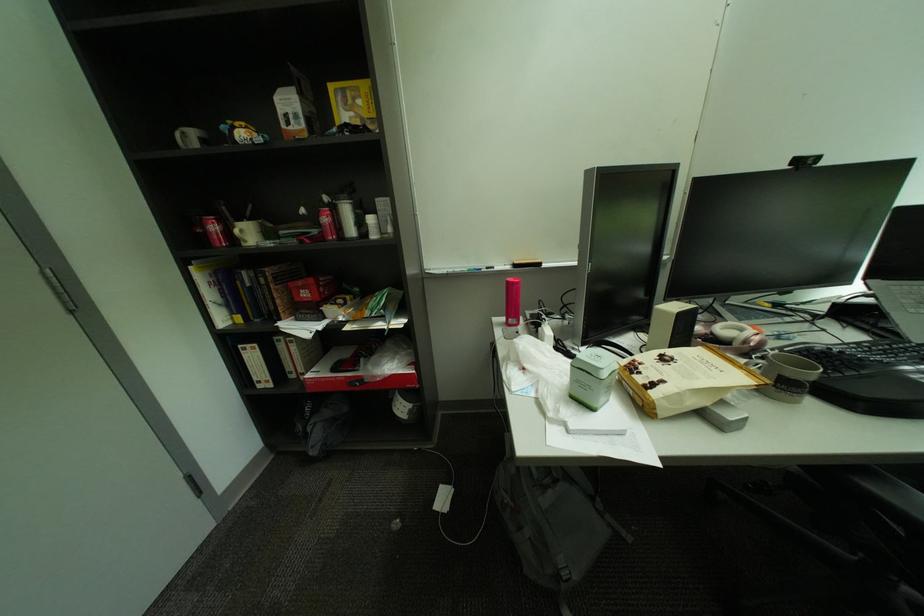
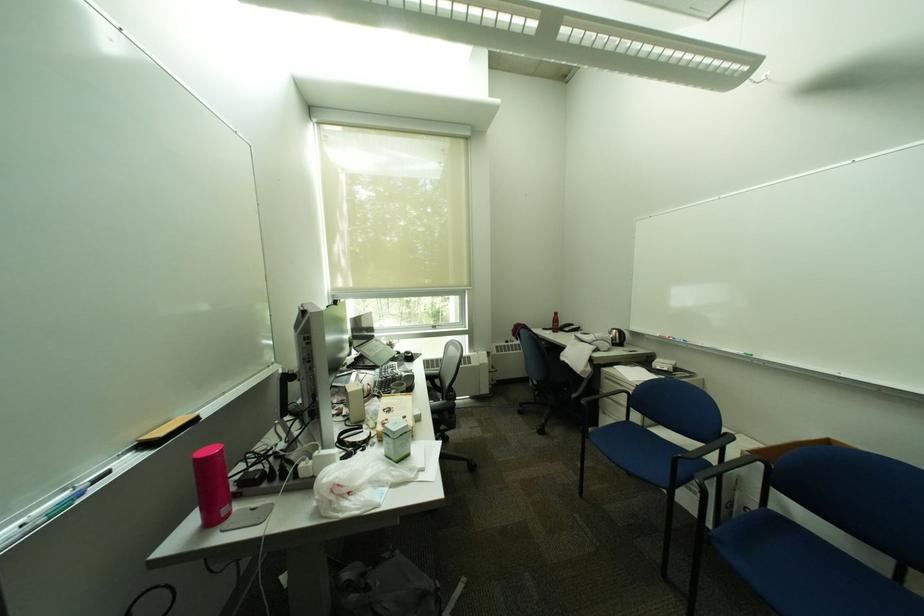
In the second image, find the point that corresponds to point 610,513 in the first image.

(400, 560)